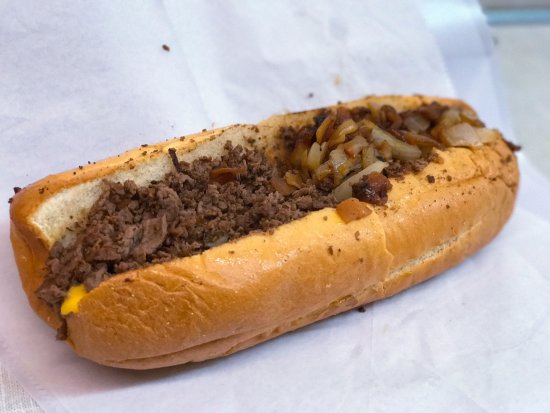
You are a GUI agent. You are given a task and a screenshot of the screen. Output one action in this format:
    pyautogui.click(x=<x>, y=<y>)
    Task: Click on the white table
    The height and width of the screenshot is (413, 550).
    Given the screenshot: What is the action you would take?
    pyautogui.click(x=531, y=67), pyautogui.click(x=19, y=408)